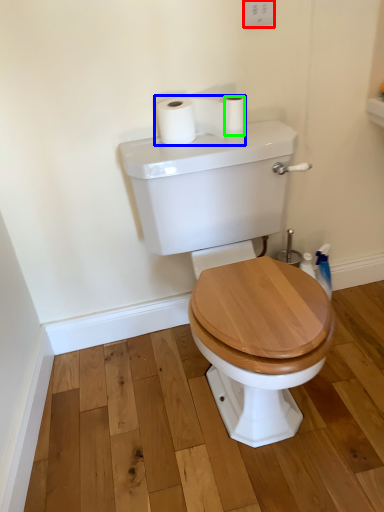
Question: Which object is positioned closest to electric outlet (highlighted by a red box)? Select from toilet paper (highlighted by a blue box) and toilet paper (highlighted by a green box).

Choices:
 (A) toilet paper
 (B) toilet paper

Answer: (B)